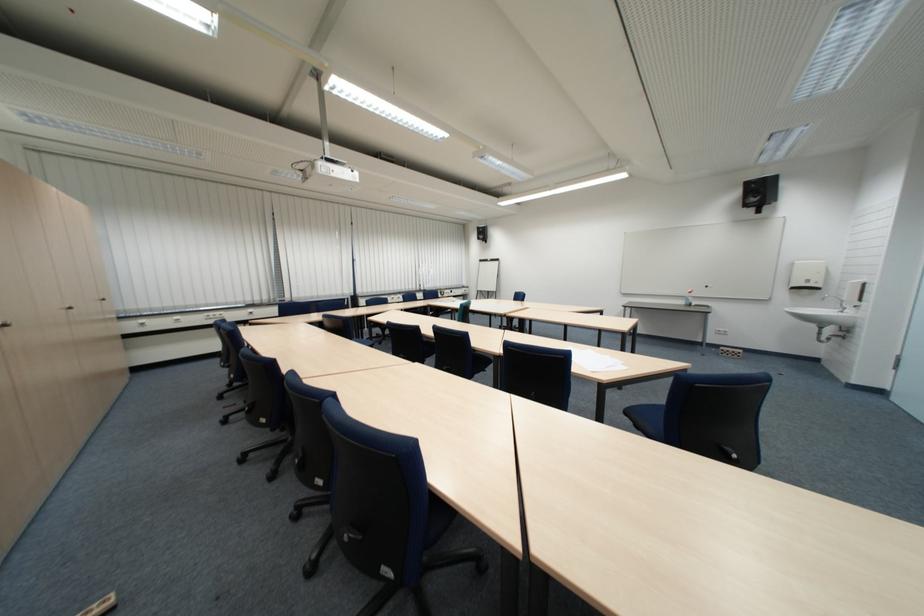
What do you see at coordinates (855, 293) in the screenshot? I see `a white soap dispenser` at bounding box center [855, 293].